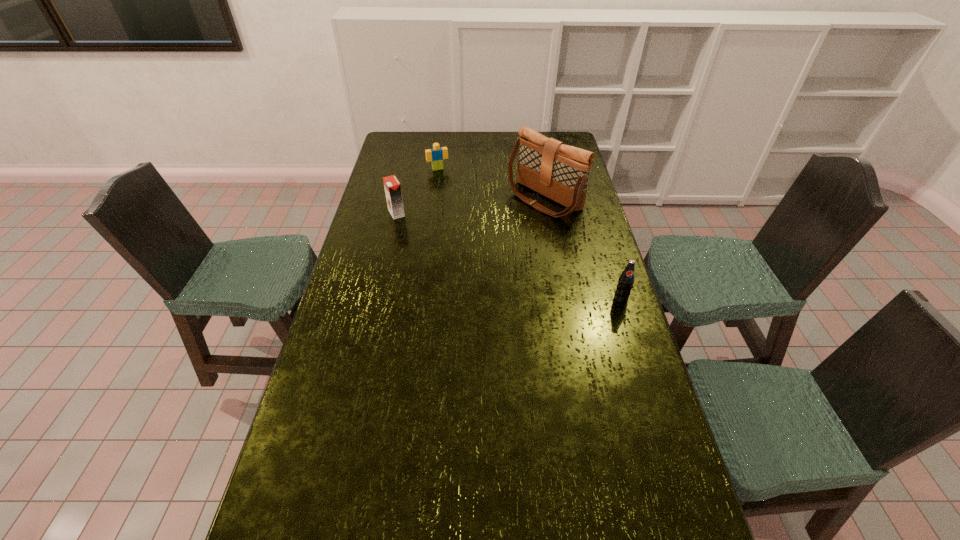
Locate an element on the screen. the leftmost object is located at coordinates (392, 186).

You are a GUI agent. You are given a task and a screenshot of the screen. Output one action in this format:
    pyautogui.click(x=<x>, y=<y>)
    Task: Click on the nearest object
    The image size is (960, 540).
    Given the screenshot: What is the action you would take?
    pyautogui.click(x=626, y=280)

Locate an element on the screen. the rightmost object is located at coordinates [626, 280].

Identify the location of the farthest object. (436, 155).

What are the coordinates of `Lego` in the screenshot? It's located at coord(436,155).

The image size is (960, 540). What are the coordinates of `shoulder bag` in the screenshot? It's located at (560, 172).

Image resolution: width=960 pixels, height=540 pixels. Identify the location of the second object from right to left. (560, 172).

Locate an element on the screen. This screenshot has width=960, height=540. vacant area situated 0.160m on the back of the leftmost object is located at coordinates (403, 186).

This screenshot has height=540, width=960. Find the location of `vacant space situated 0.120m on the front label of the nearest object`. vacant space situated 0.120m on the front label of the nearest object is located at coordinates (632, 333).

Identify the location of free space located on the face of the Lego. (463, 217).